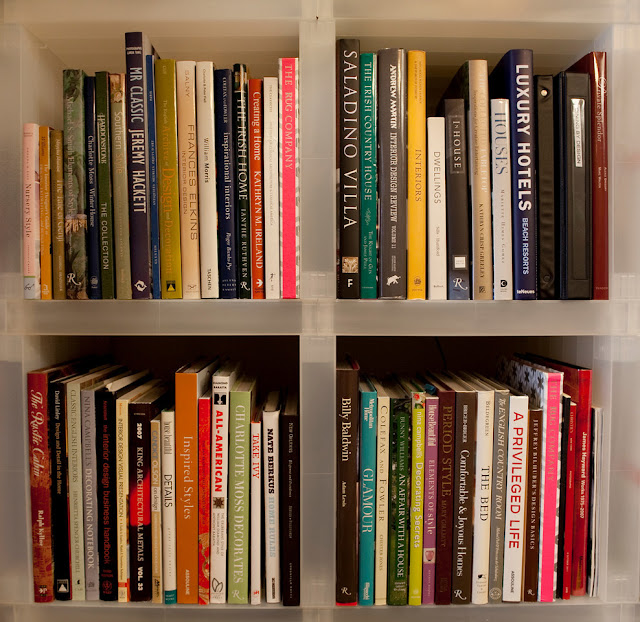
This screenshot has height=622, width=640. Identify the location of gray books. (352, 239).